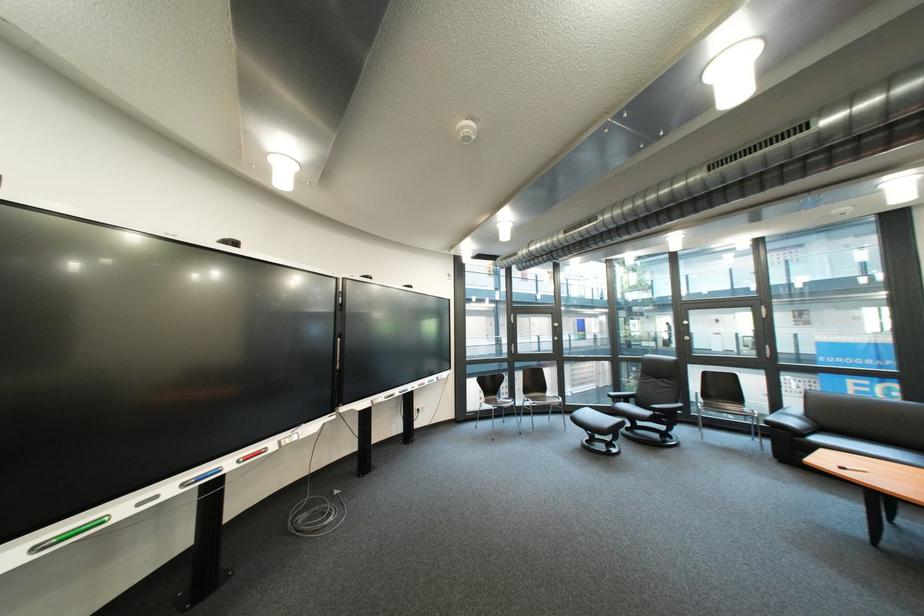
The image size is (924, 616). Describe the element at coordinates (621, 395) in the screenshot. I see `a chair armrest` at that location.